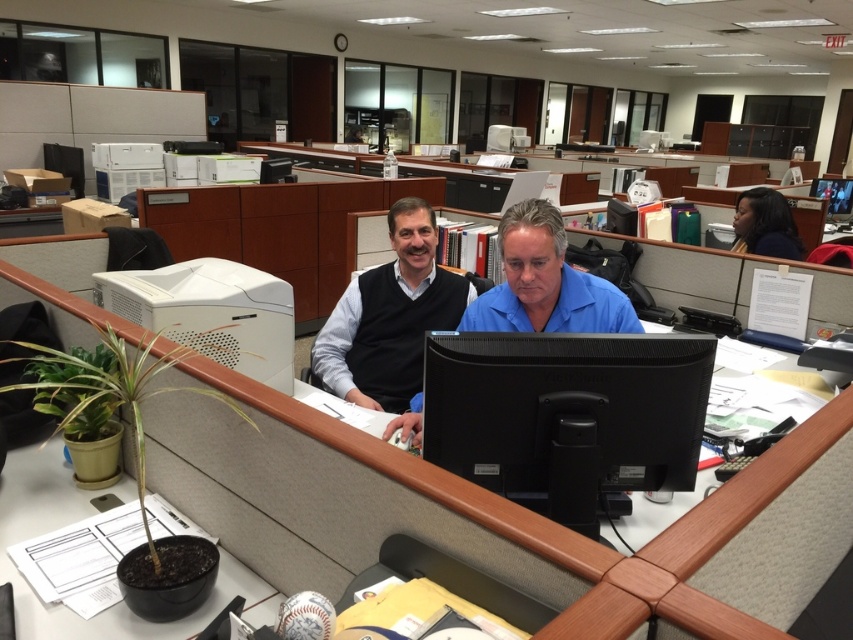
Does point (560, 305) come farther from viewer compared to point (846, 209)?

No, (560, 305) is in front of (846, 209).

Who is higher up, blue matte shirt at center or black glossy computer monitor at upper right?

Positioned higher is black glossy computer monitor at upper right.

Is point (634, 317) positioned before point (821, 189)?

Yes, it is.

This screenshot has height=640, width=853. I want to click on blue matte shirt at center, so click(x=544, y=282).

Which is behind, point (695, 392) or point (398, 406)?

The point (398, 406) is more distant.

Does black glossy monitor at center have a smaller size compared to matte black sweater at center?

Correct, black glossy monitor at center occupies less space than matte black sweater at center.

Is point (699, 401) positioned after point (421, 376)?

No, it is not.

You are a GUI agent. You are given a task and a screenshot of the screen. Output one action in this format:
    pyautogui.click(x=<x>, y=<y>)
    Task: Click on the black glossy monitor at center
    
    Given the screenshot: What is the action you would take?
    pyautogui.click(x=566, y=416)

How distant is white matte desktop computer at upper left from black glossy computer monitor at upper right?

white matte desktop computer at upper left and black glossy computer monitor at upper right are 6.23 meters apart.

Image resolution: width=853 pixels, height=640 pixels. In order to click on white matte desktop computer at upper left in this screenshot , I will do `click(212, 312)`.